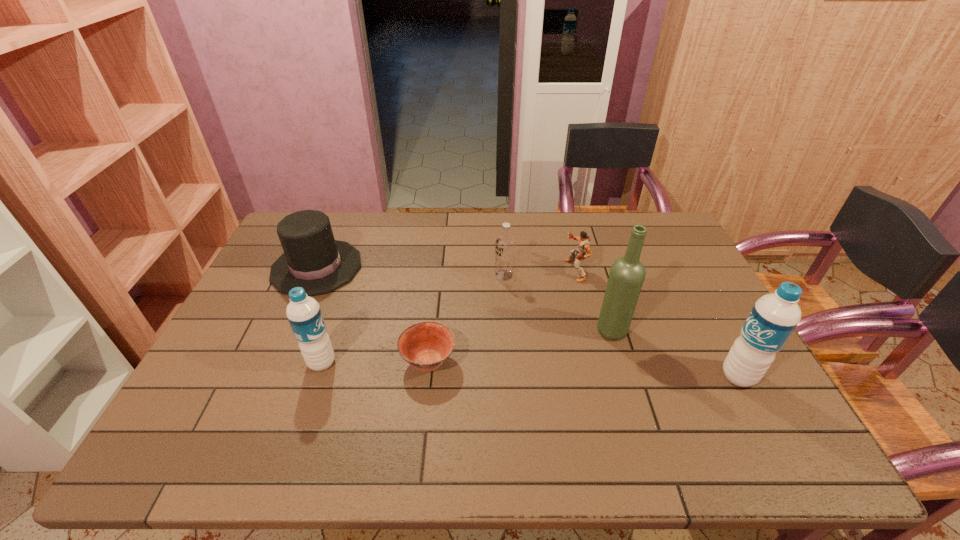
Where is `empty space between the shorter water bottle and the puncher`? This screenshot has width=960, height=540. empty space between the shorter water bottle and the puncher is located at coordinates (448, 316).

I want to click on empty location between the fourth object from right to left and the shortest object, so click(467, 318).

Find the location of a particular element. vacant space in between the left water bottle and the puncher is located at coordinates (448, 316).

Identify the location of free space between the wine bottle and the dress hat. The width and height of the screenshot is (960, 540). (465, 299).

Locate which object ranks second in proximity to the shortest object. Please provide its 2D coordinates. Your answer should be formatted as a tuple, i.e. [(x, y)], where the tuple contains the x and y coordinates of a point satisfying the conditions above.

[(312, 259)]

Locate which object ranks third in proximity to the right water bottle. Please provide its 2D coordinates. Your answer should be formatted as a tuple, i.e. [(x, y)], where the tuple contains the x and y coordinates of a point satisfying the conditions above.

[(505, 243)]

Find the location of a particular element. free space that satisfies the following two spatial constraints: 1. on the front label of the wine bottle; 2. on the right side of the vodka is located at coordinates (508, 330).

The image size is (960, 540). In order to click on free spot that satisfies the following two spatial constraints: 1. on the front of the wine bottle with the decoration; 2. on the right side of the dress hat in this screenshot , I will do `click(290, 330)`.